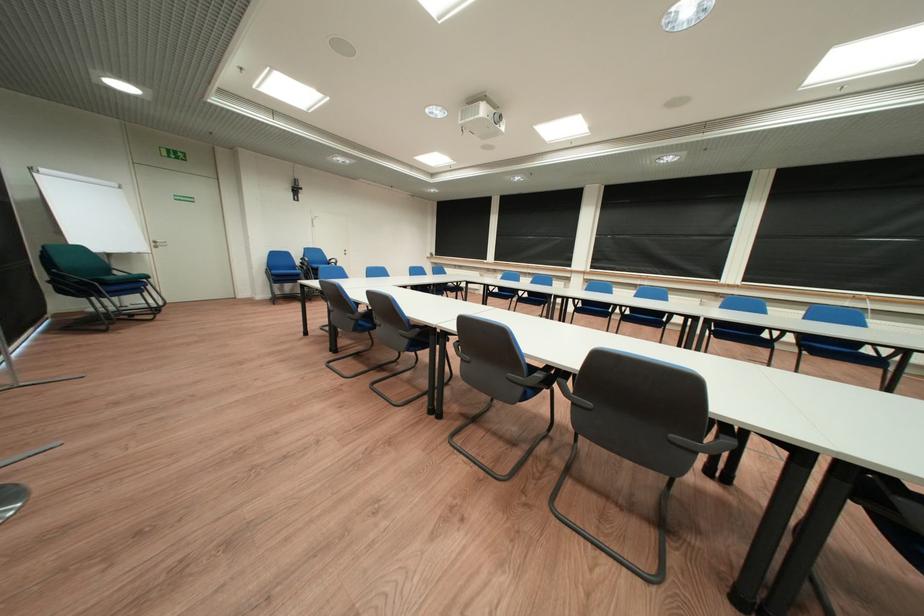
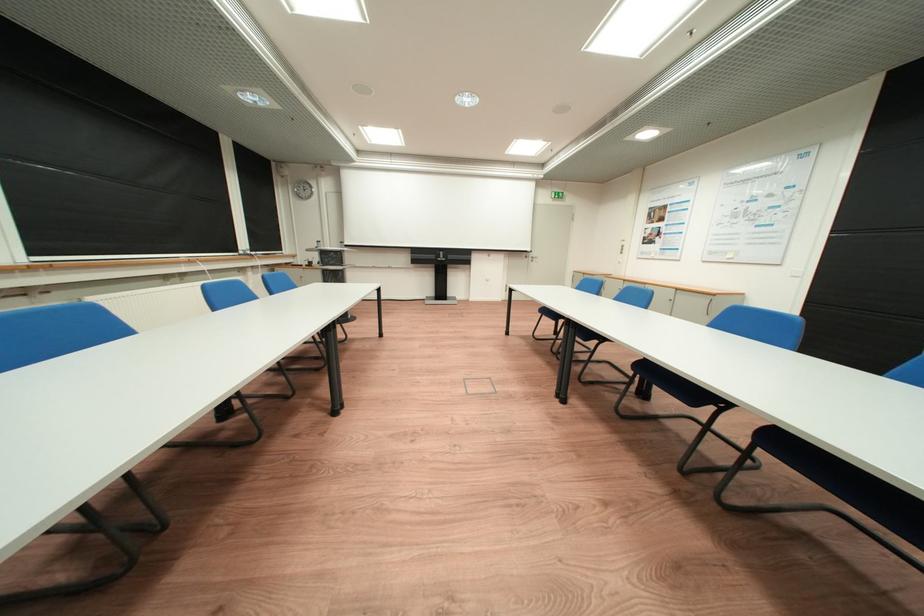
Question: I am providing you with two images of the same scene from different viewpoints. Which of the following objects are not visible in image2?

Choices:
 (A) metal folding rack
 (B) blue chair sitting surface
 (C) door handle
 (D) black chair armrest

Answer: (D)